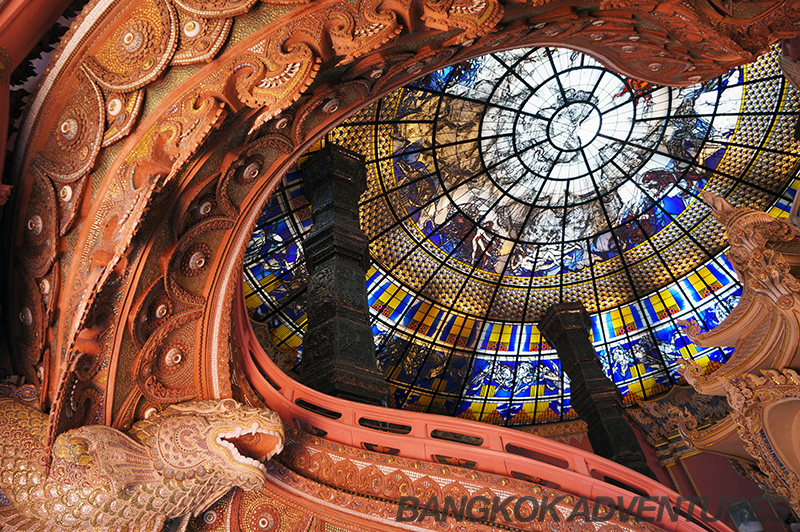
Find the location of a particular element. domed ceiling is located at coordinates (574, 128).